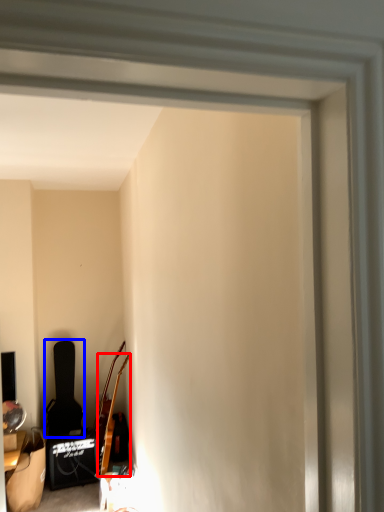
Question: Which object appears closest to the camera in this image, guitar (highlighted by a red box) or chair (highlighted by a blue box)?

Choices:
 (A) guitar
 (B) chair

Answer: (A)